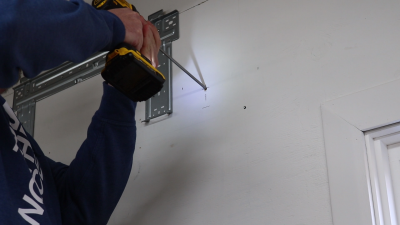
Where is `door`? door is located at coordinates (391, 153).